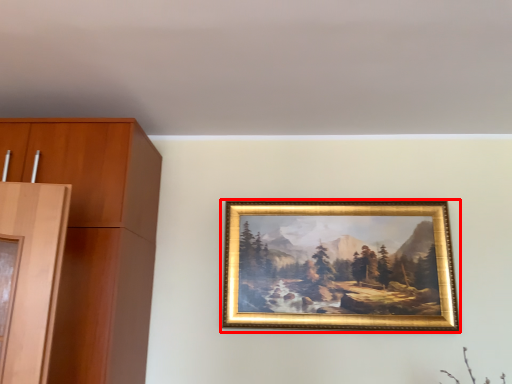
Question: From the image, what is the correct spatial relationship of picture frame (annotated by the red box) in relation to cabinetry?

Choices:
 (A) right
 (B) left

Answer: (A)